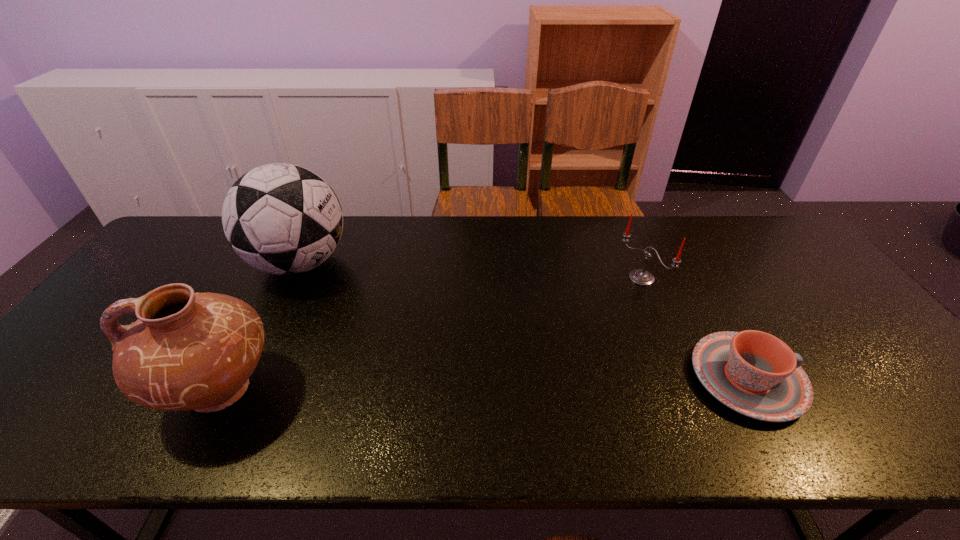
The height and width of the screenshot is (540, 960). In order to click on vacant region between the pottery and the third tallest object in this screenshot , I will do `click(431, 334)`.

Locate an element on the screen. Image resolution: width=960 pixels, height=540 pixels. free space between the chinaware and the soccer ball is located at coordinates (523, 321).

The width and height of the screenshot is (960, 540). I want to click on object that stands as the closest to the soccer ball, so click(x=187, y=351).

Identify which object is the closest to the soccer ball. Please provide its 2D coordinates. Your answer should be formatted as a tuple, i.e. [(x, y)], where the tuple contains the x and y coordinates of a point satisfying the conditions above.

[(187, 351)]

Where is `free space that satisfies the following two spatial constraints: 1. on the front side of the soccer ball; 2. on the right side of the candle`? The width and height of the screenshot is (960, 540). free space that satisfies the following two spatial constraints: 1. on the front side of the soccer ball; 2. on the right side of the candle is located at coordinates (293, 278).

Identify the location of blank space that satisfies the following two spatial constraints: 1. on the front side of the shortest object; 2. on the handle side of the third tallest object. Image resolution: width=960 pixels, height=540 pixels. (684, 378).

In order to click on blank space that satisfies the following two spatial constraints: 1. on the front side of the candle; 2. on the handle side of the chinaware in this screenshot , I will do `click(684, 378)`.